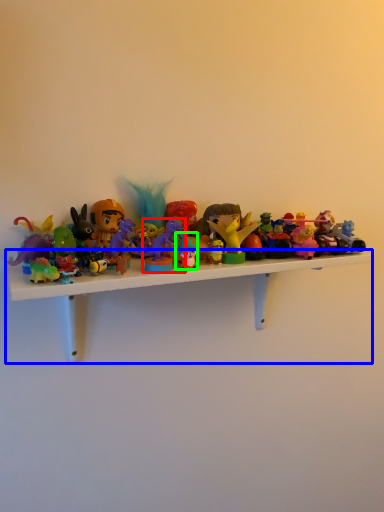
Question: Which is nearer to the toy (highlighted by a red box)? shelf (highlighted by a blue box) or toy (highlighted by a green box).

Choices:
 (A) shelf
 (B) toy

Answer: (B)